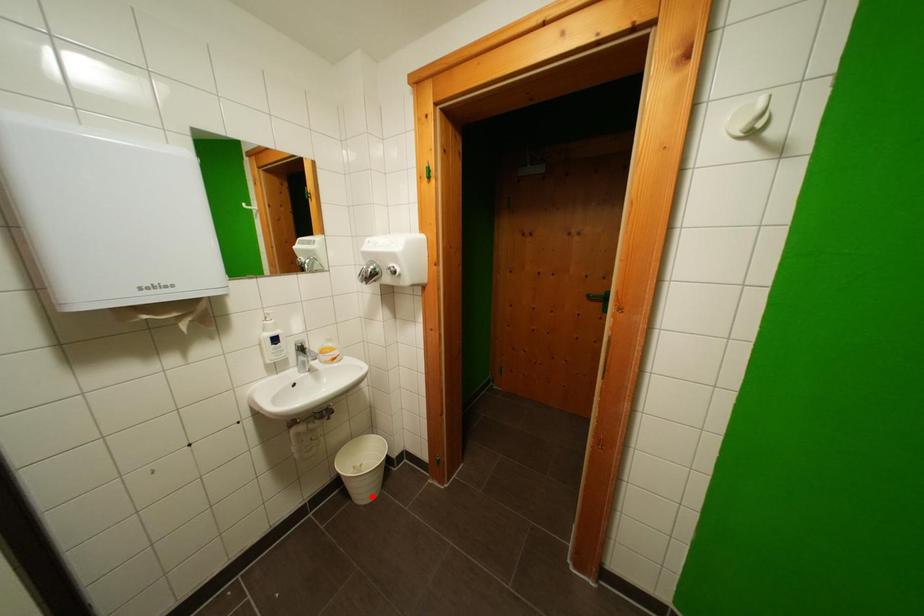
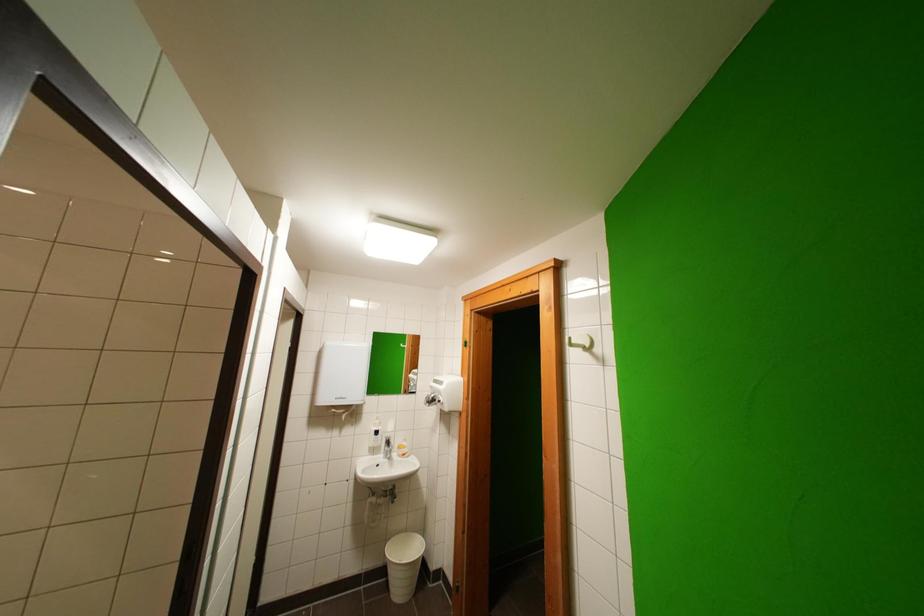
Question: I am providing you with two images of the same scene from different viewpoints. Image1 has a red point marked. In image2, the corresponding 3D location appears at what relative position? Reply with the corresponding letter.

Choices:
 (A) Closer
 (B) Farther

Answer: (A)